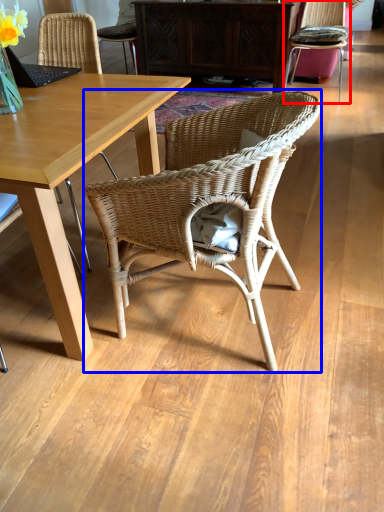
Question: Which point is closer to the camera, chair (highlighted by a red box) or chair (highlighted by a blue box)?

Choices:
 (A) chair
 (B) chair

Answer: (B)